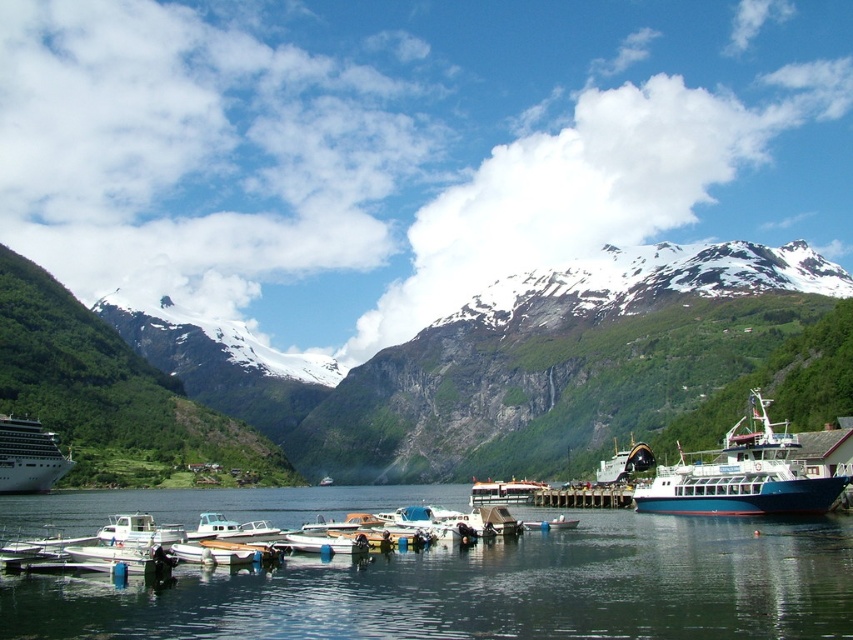
Question: Which point is closer to the camera taking this photo?

Choices:
 (A) (158, 442)
 (B) (630, 442)
 (C) (18, 454)
 (D) (746, 426)

Answer: (D)

Question: Which is nearer to the transparent water at center?

Choices:
 (A) blue matte boat at lower right
 (B) matte black cruise ship at left
 (C) wooden dock at center
 (D) metallic blue ferry at center

Answer: (A)

Question: Is blue matte boat at lower right in front of matte black cruise ship at left?

Choices:
 (A) no
 (B) yes

Answer: (B)

Question: Does transparent water at center appear under blue matte boat at lower right?

Choices:
 (A) yes
 (B) no

Answer: (A)

Question: Is green rocky mountain at center wider than blue matte boat at lower right?

Choices:
 (A) no
 (B) yes

Answer: (B)

Question: Which point is closer to the camera?

Choices:
 (A) (30, 490)
 (B) (596, 468)

Answer: (A)